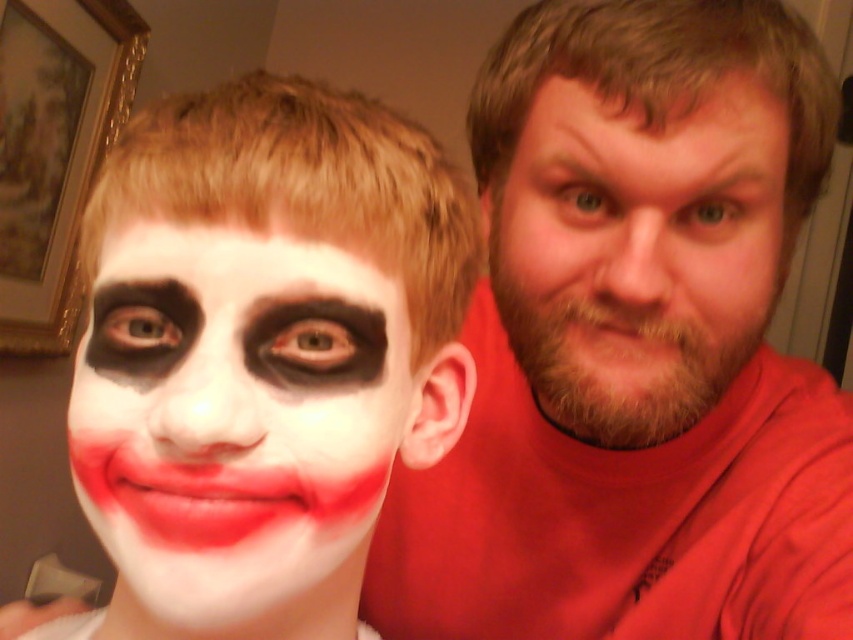
You are taking a selfie with two people. The person on the left has clown makeup, and the person on the right is wearing a smooth red shirt. According to the image, where is the smooth red shirt at right positioned in relation to the clown makeup person?

The smooth red shirt at right is located at point (635, 346) relative to the clown makeup person.

You are taking a photo of the bearded man at right and the smooth red shirt at right. Which object is closer to the camera?

→ The smooth red shirt at right is closer to the camera because the bearded man at right is behind it.